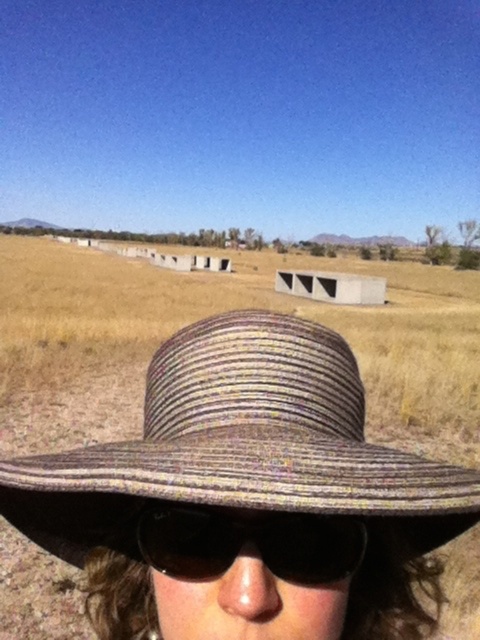
Question: Which object appears closest to the camera in this image?

Choices:
 (A) black reflective sunglasses at center
 (B) woven straw hat at center

Answer: (B)

Question: Which point is closer to the camera?

Choices:
 (A) (147, 508)
 (B) (149, 454)

Answer: (B)

Question: Can you confirm if woven straw hat at center is smaller than black reflective sunglasses at center?

Choices:
 (A) yes
 (B) no

Answer: (B)

Question: Does woven straw hat at center have a greater width compared to black reflective sunglasses at center?

Choices:
 (A) no
 (B) yes

Answer: (B)

Question: Which object is farther from the camera taking this photo?

Choices:
 (A) woven straw hat at center
 (B) black reflective sunglasses at center

Answer: (B)

Question: Is woven straw hat at center below black reflective sunglasses at center?

Choices:
 (A) no
 (B) yes

Answer: (A)